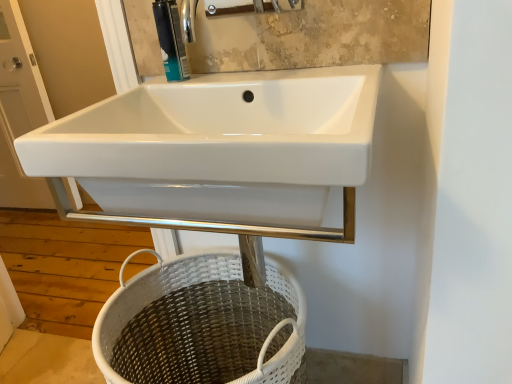
Question: Could white wicker basket at lower center be considered to be inside matte plastic soap dispenser at upper center?

Choices:
 (A) no
 (B) yes

Answer: (A)

Question: Can you confirm if matte plastic soap dispenser at upper center is smaller than white wicker basket at lower center?

Choices:
 (A) no
 (B) yes

Answer: (B)

Question: Does matte plastic soap dispenser at upper center have a lesser height compared to white wicker basket at lower center?

Choices:
 (A) no
 (B) yes

Answer: (B)

Question: Is there a large distance between matte plastic soap dispenser at upper center and white wicker basket at lower center?

Choices:
 (A) yes
 (B) no

Answer: (B)

Question: Considering the relative sizes of matte plastic soap dispenser at upper center and white wicker basket at lower center in the image provided, is matte plastic soap dispenser at upper center wider than white wicker basket at lower center?

Choices:
 (A) yes
 (B) no

Answer: (B)

Question: From the image's perspective, is matte plastic soap dispenser at upper center located beneath white wicker basket at lower center?

Choices:
 (A) yes
 (B) no

Answer: (B)

Question: Is matte plastic soap dispenser at upper center completely or partially inside white glossy sink at upper left?

Choices:
 (A) no
 (B) yes

Answer: (A)

Question: Can you confirm if white glossy sink at upper left is wider than matte plastic soap dispenser at upper center?

Choices:
 (A) no
 (B) yes

Answer: (B)

Question: Is white glossy sink at upper left closer to camera compared to matte plastic soap dispenser at upper center?

Choices:
 (A) yes
 (B) no

Answer: (B)

Question: From the image's perspective, would you say white glossy sink at upper left is shown under matte plastic soap dispenser at upper center?

Choices:
 (A) yes
 (B) no

Answer: (B)

Question: Considering the relative positions of white glossy sink at upper left and matte plastic soap dispenser at upper center in the image provided, is white glossy sink at upper left to the left of matte plastic soap dispenser at upper center from the viewer's perspective?

Choices:
 (A) no
 (B) yes

Answer: (B)

Question: Considering the relative sizes of white glossy sink at upper left and matte plastic soap dispenser at upper center in the image provided, is white glossy sink at upper left smaller than matte plastic soap dispenser at upper center?

Choices:
 (A) no
 (B) yes

Answer: (A)

Question: Considering the relative positions of white glossy sink at upper left and white wicker basket at lower center in the image provided, is white glossy sink at upper left to the left of white wicker basket at lower center from the viewer's perspective?

Choices:
 (A) no
 (B) yes

Answer: (B)